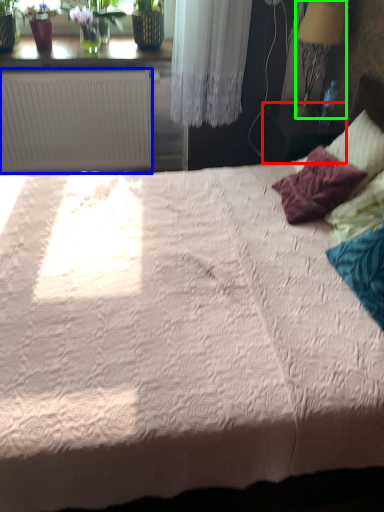
Question: Based on their relative distances, which object is nearer to table (highlighted by a red box)? Choose from radiator (highlighted by a blue box) and lamp (highlighted by a green box).

Choices:
 (A) radiator
 (B) lamp

Answer: (B)